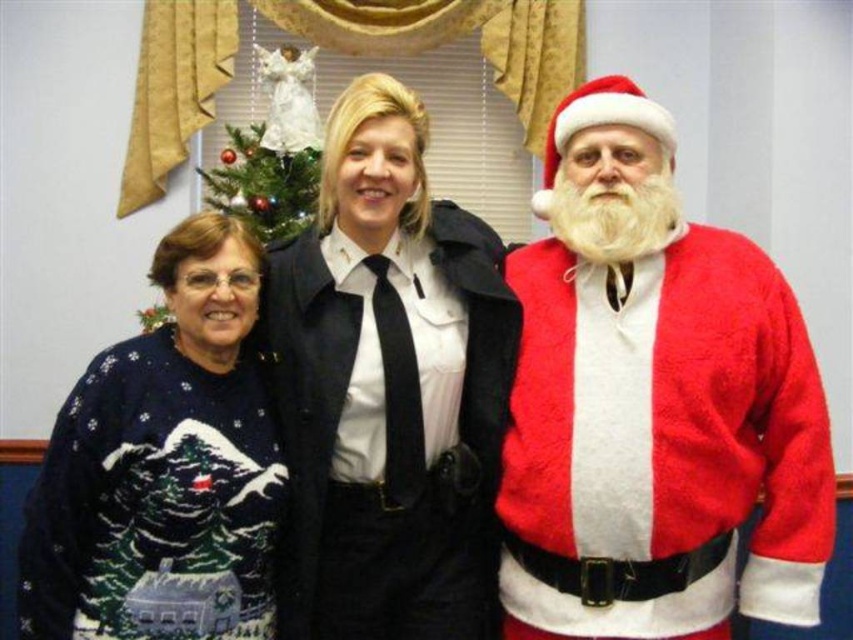
You are a photographer trying to capture a clear shot of the matte black uniform at center and the green matte christmas tree at center. Which object is closer to the camera?

The matte black uniform at center is closer to the camera because it is in front of the green matte christmas tree at center.

You are trying to determine the spatial relationship between the fuzzy red santa at right and the matte black uniform at center in the festive photo. Based on the scene description, which object is placed higher in the image?

The fuzzy red santa at right is positioned over matte black uniform at center, meaning it is placed higher in the image.

You are organizing a photo shoot and need to ensure that all participants are visible in the frame. Given that the matte black uniform at center and the navy sweater at left are two key elements, which one might require more space in the frame to accommodate its size?

The matte black uniform at center requires more space in the frame because it is bigger than the navy sweater at left.